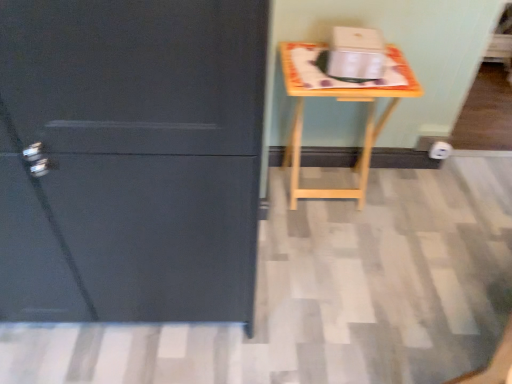
Question: Should I look upward or downward to see wooden table at right?

Choices:
 (A) down
 (B) up

Answer: (B)